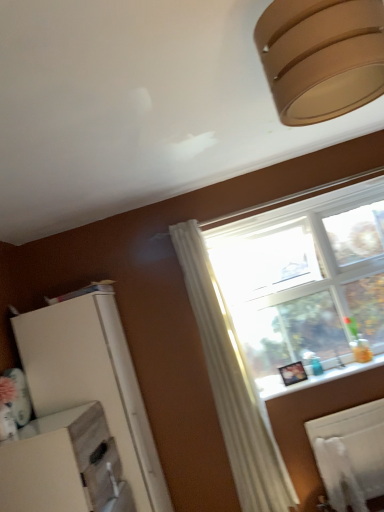
You are a GUI agent. You are given a task and a screenshot of the screen. Output one action in this format:
    pyautogui.click(x=<x>, y=<y>)
    Task: Click on the vacant region above white matte radiator at lower right (from a real-world perspective)
    
    Given the screenshot: What is the action you would take?
    pyautogui.click(x=344, y=409)